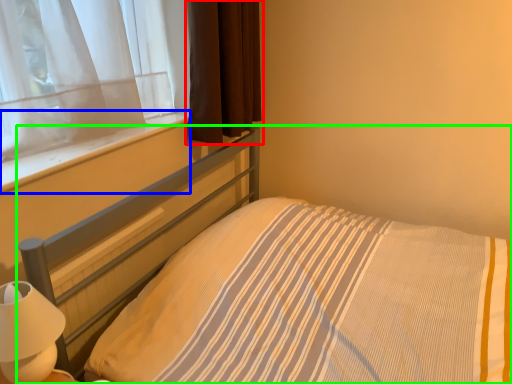
Question: Which object is the farthest from curtain (highlighted by a red box)? Choose among these: window sill (highlighted by a blue box) or bed (highlighted by a green box).

Choices:
 (A) window sill
 (B) bed

Answer: (B)